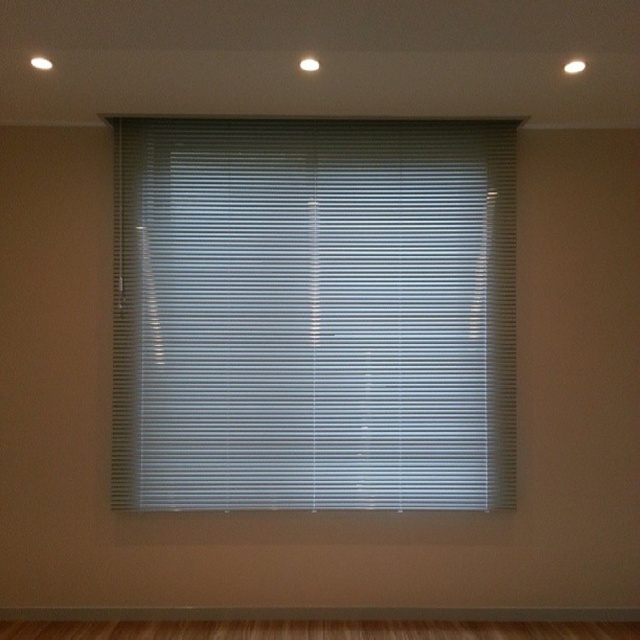
You are standing in the room and want to adjust the white matte blinds at center. Based on their position, where should you reach to operate them?

You should reach the point at the top of the white matte blinds at center, where the blind holder is located, to operate them.

You are standing in the room and want to know where the white matte blinds at center are located relative to the brown wood flooring at bottom. Can you tell me their positions?

The white matte blinds at center is above the brown wood flooring at bottom.